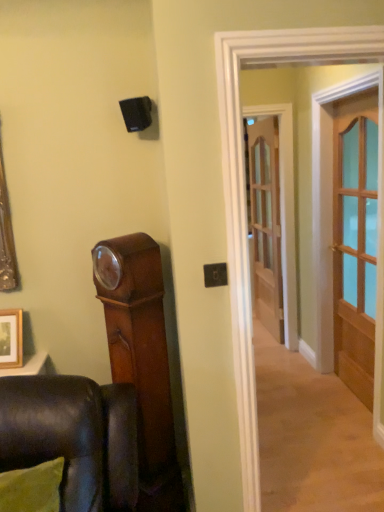
Question: Considering the positions of clear glass door at center, which is counted as the first door, starting from the back, and wooden picture frame at lower left in the image, is clear glass door at center, which is counted as the first door, starting from the back, wider or thinner than wooden picture frame at lower left?

Choices:
 (A) wide
 (B) thin

Answer: (B)

Question: In terms of height, does clear glass door at center, which is counted as the second door, starting from the front, look taller or shorter compared to wooden picture frame at lower left?

Choices:
 (A) tall
 (B) short

Answer: (A)

Question: Based on their relative distances, which object is farther from the wooden picture frame at lower left?

Choices:
 (A) clear glass door at center, which is counted as the first door, starting from the back
 (B) light brown wooden door at right, positioned as the second door in back-to-front order

Answer: (A)

Question: Considering the real-world distances, which object is closest to the wooden picture frame at lower left?

Choices:
 (A) light brown wooden door at right, which is counted as the second door, starting from the left
 (B) clear glass door at center, the second door when ordered from right to left

Answer: (A)